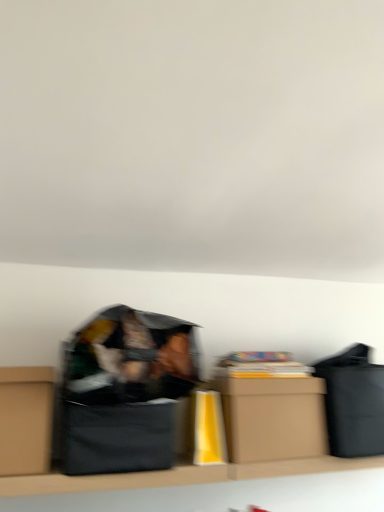
Question: Considering the relative sizes of brown cardboard box at left, which appears as the 1th box when viewed from the left, and black cardboard box at center in the image provided, is brown cardboard box at left, which appears as the 1th box when viewed from the left, shorter than black cardboard box at center?

Choices:
 (A) yes
 (B) no

Answer: (B)

Question: Considering the relative positions of brown cardboard box at left, which appears as the 1th box when viewed from the left, and black cardboard box at center in the image provided, is brown cardboard box at left, which appears as the 1th box when viewed from the left, behind black cardboard box at center?

Choices:
 (A) no
 (B) yes

Answer: (A)

Question: Does brown cardboard box at left, which appears as the 1th box when viewed from the left, have a greater height compared to black cardboard box at center?

Choices:
 (A) no
 (B) yes

Answer: (B)

Question: Is brown cardboard box at left, which is the second box in right-to-left order, beside black cardboard box at center?

Choices:
 (A) yes
 (B) no

Answer: (B)

Question: Is brown cardboard box at left, which appears as the 1th box when viewed from the left, surrounding black cardboard box at center?

Choices:
 (A) yes
 (B) no

Answer: (B)

Question: Is brown cardboard box at center, the 2th box from the left, inside the boundaries of black cardboard box at center, or outside?

Choices:
 (A) inside
 (B) outside

Answer: (B)

Question: Does point (248, 443) appear closer or farther from the camera than point (132, 440)?

Choices:
 (A) closer
 (B) farther

Answer: (B)

Question: Based on their sizes in the image, would you say brown cardboard box at center, the 2th box from the left, is bigger or smaller than black cardboard box at center?

Choices:
 (A) small
 (B) big

Answer: (B)

Question: Considering the relative positions of brown cardboard box at center, the 2th box from the left, and black cardboard box at center in the image provided, is brown cardboard box at center, the 2th box from the left, to the left or to the right of black cardboard box at center?

Choices:
 (A) right
 (B) left

Answer: (A)

Question: From the image's perspective, relative to brown cardboard box at center, the 2th box from the left, is brown cardboard box at left, which is the second box in right-to-left order, above or below?

Choices:
 (A) below
 (B) above

Answer: (B)

Question: Based on their positions, is brown cardboard box at left, which is the second box in right-to-left order, located to the left or right of brown cardboard box at center, the 2th box from the left?

Choices:
 (A) right
 (B) left

Answer: (B)

Question: Does point (49, 435) appear closer or farther from the camera than point (241, 454)?

Choices:
 (A) closer
 (B) farther

Answer: (A)

Question: Considering the positions of brown cardboard box at left, which is the second box in right-to-left order, and brown cardboard box at center, the 1th box viewed from the right, in the image, is brown cardboard box at left, which is the second box in right-to-left order, bigger or smaller than brown cardboard box at center, the 1th box viewed from the right,?

Choices:
 (A) big
 (B) small

Answer: (B)

Question: Which is correct: black cardboard box at center is inside brown cardboard box at left, which is the second box in right-to-left order, or outside of it?

Choices:
 (A) inside
 (B) outside

Answer: (B)

Question: In terms of width, does black cardboard box at center look wider or thinner when compared to brown cardboard box at left, which is the second box in right-to-left order?

Choices:
 (A) thin
 (B) wide

Answer: (A)